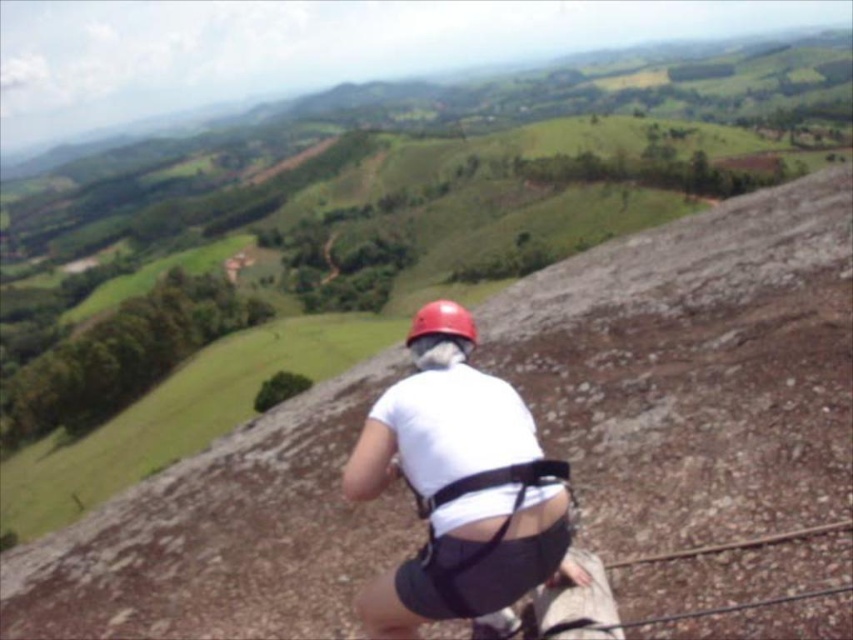
You are a photographer taking a picture of the climber. The white matte shirt at center and the matte red helmet at center are both in the frame. If you want to focus on the object that is more to the left, which one should you adjust your camera to capture?

The white matte shirt at center is positioned on the left side of the matte red helmet at center, so you should focus on the white matte shirt at center to capture the object more to the left.

You are a rock climber trying to reach the top of the cliff. You notice a white matte shirt at center at the point marked by coordinates (x=454, y=483). Is this point on the climber or part of the rock formation?

The white matte shirt at center is located at point (x=454, y=483), which is part of the climber since the shirt is described as being worn by the person in the scene.